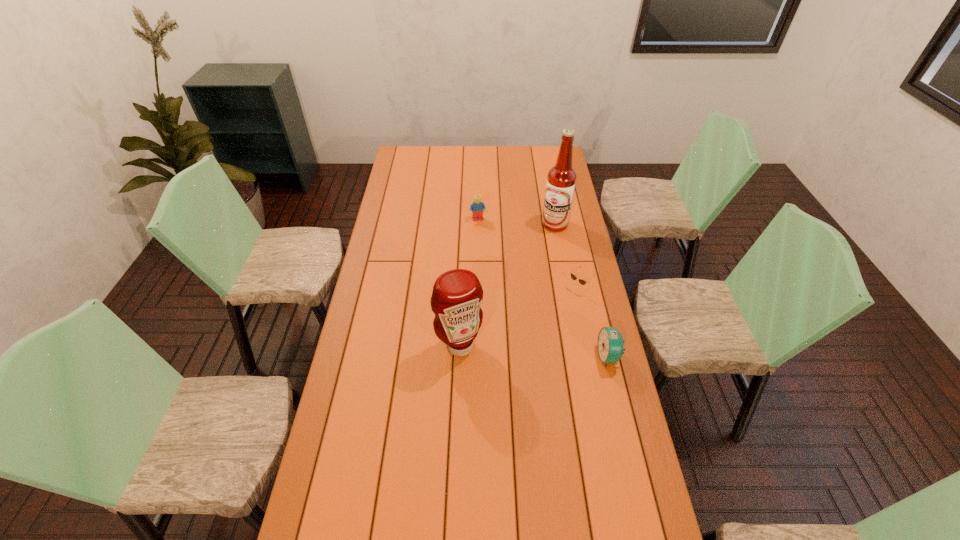
At what (x,y) coordinates should I click in order to perform the action: click on free space located 0.190m on the label side of the tallest object. Please return your answer as a coordinate pair (x, y). The height and width of the screenshot is (540, 960). Looking at the image, I should click on (552, 261).

Where is `free spot located on the label side of the tallest object`? free spot located on the label side of the tallest object is located at coordinates (552, 256).

Locate an element on the screen. free region located on the label side of the tallest object is located at coordinates (550, 284).

This screenshot has height=540, width=960. In order to click on vacant space located 0.150m in front of the lenses of the third nearest object in this screenshot , I will do `click(541, 322)`.

Identify the location of free space located in front of the lenses of the third nearest object. The width and height of the screenshot is (960, 540). pos(516,347).

Image resolution: width=960 pixels, height=540 pixels. I want to click on free space located in front of the lenses of the third nearest object, so click(516, 347).

I want to click on vacant space located on the face of the Lego, so click(500, 285).

The image size is (960, 540). Find the location of `free space located 0.180m on the face of the Lego`. free space located 0.180m on the face of the Lego is located at coordinates (489, 249).

Where is `free space located 0.310m on the face of the Lego`? This screenshot has width=960, height=540. free space located 0.310m on the face of the Lego is located at coordinates (495, 269).

At what (x,y) coordinates should I click in order to perform the action: click on alarm clock that is at the right edge. Please return your answer as a coordinate pair (x, y). The height and width of the screenshot is (540, 960). Looking at the image, I should click on (610, 344).